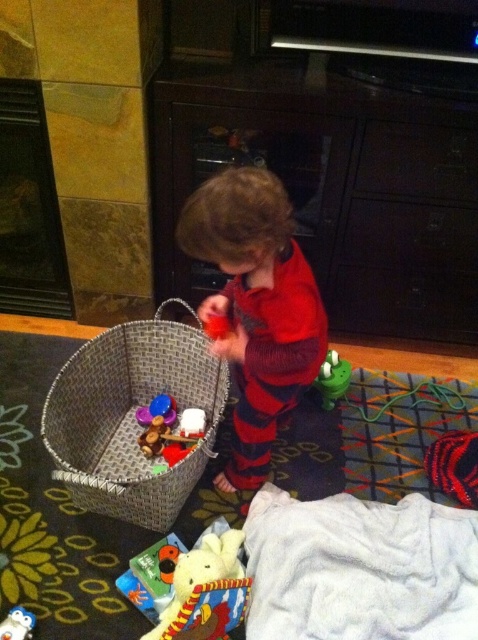
You are a parent trying to organize the toys in the room. You have a dark wood drawer at center and a white plush duck at lower left. Which object can hold more toys based on their size?

The dark wood drawer at center is larger in size than the white plush duck at lower left, so it can hold more toys.

You are a parent looking for your child. You see the woven brown basket at lower left and the wooden toy at center. Which object is closer to the left side of the room?

The woven brown basket at lower left is closer to the left side of the room since it is positioned to the left of the wooden toy at center.